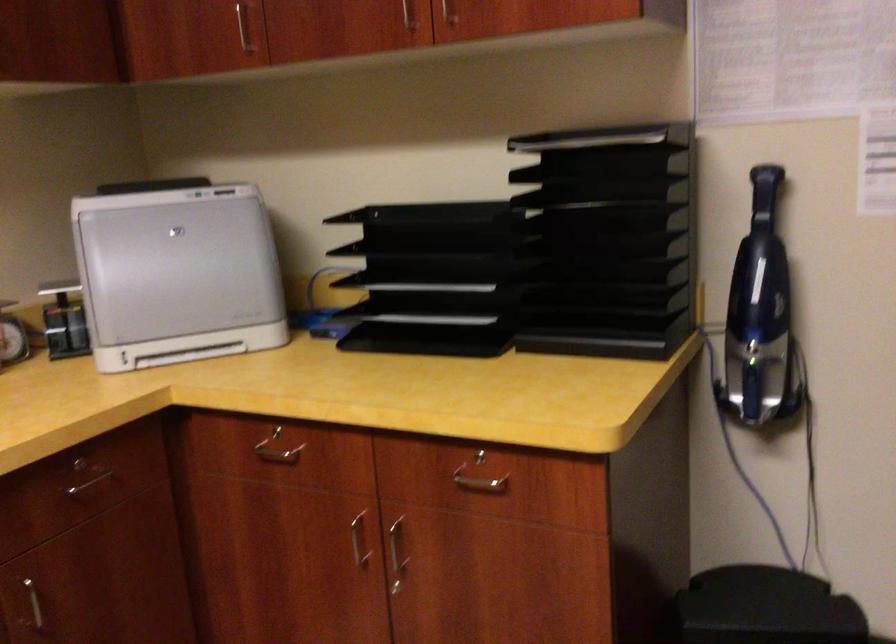
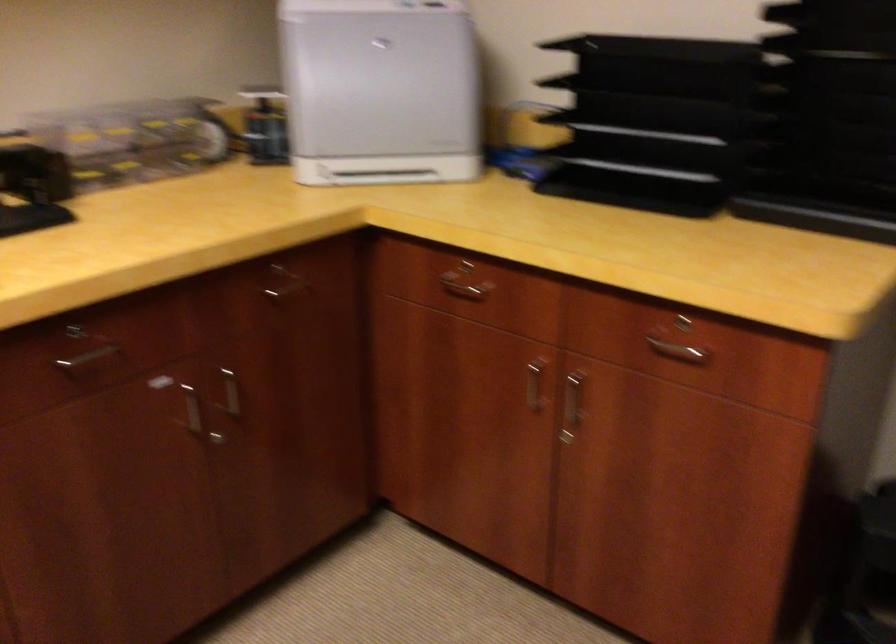
The images are taken continuously from a first-person perspective. In which direction are you moving?

The cameraman walked toward left, forward.